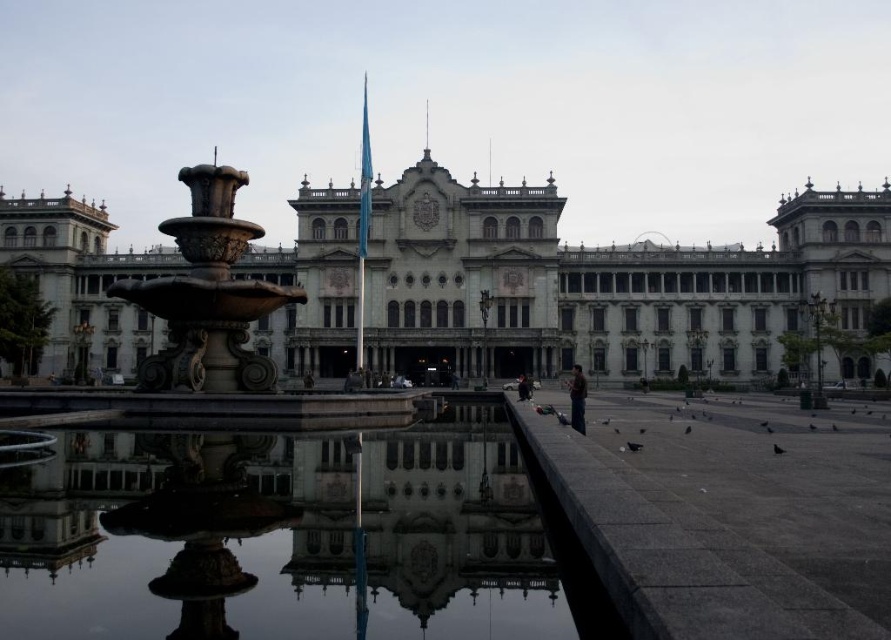
Question: Does stone fountain at center have a larger size compared to reflective glass water at center?

Choices:
 (A) yes
 (B) no

Answer: (A)

Question: Is stone building at center to the left of reflective glass water at center from the viewer's perspective?

Choices:
 (A) no
 (B) yes

Answer: (A)

Question: Is stone fountain at center to the right of reflective glass water at center from the viewer's perspective?

Choices:
 (A) no
 (B) yes

Answer: (A)

Question: Which point appears closest to the camera in this image?

Choices:
 (A) (379, 310)
 (B) (83, 588)

Answer: (B)

Question: Which point is farther to the camera?

Choices:
 (A) reflective glass water at center
 (B) stone fountain at center

Answer: (B)

Question: Which point is farther to the camera?

Choices:
 (A) stone fountain at center
 (B) reflective glass water at center
 (C) stone building at center

Answer: (C)